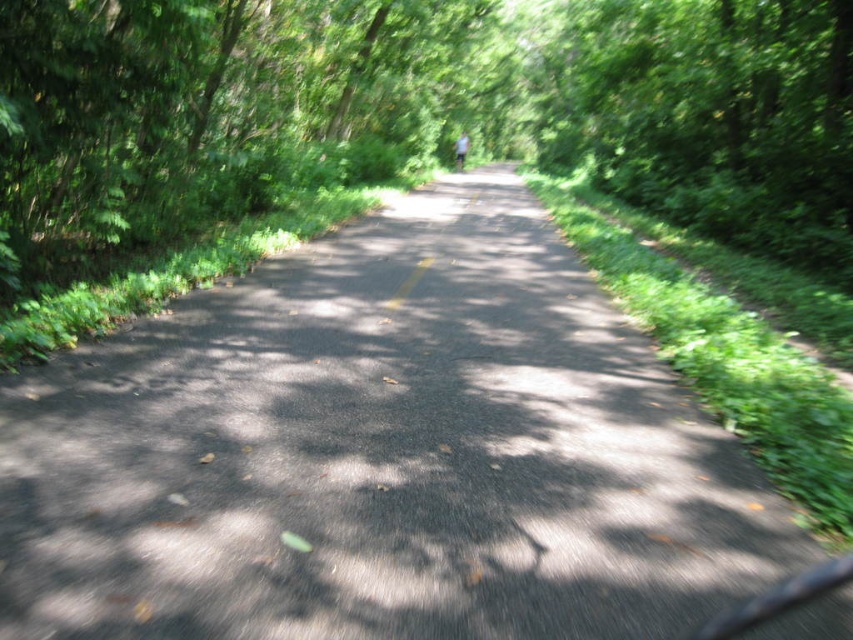
Can you confirm if black asphalt road at center is shorter than white cotton shirt at center?

No, black asphalt road at center is not shorter than white cotton shirt at center.

Between black asphalt road at center and white cotton shirt at center, which one has more height?

Standing taller between the two is black asphalt road at center.

Does point (517, 272) come in front of point (457, 157)?

Yes, it is in front of point (457, 157).

I want to click on black asphalt road at center, so click(x=381, y=452).